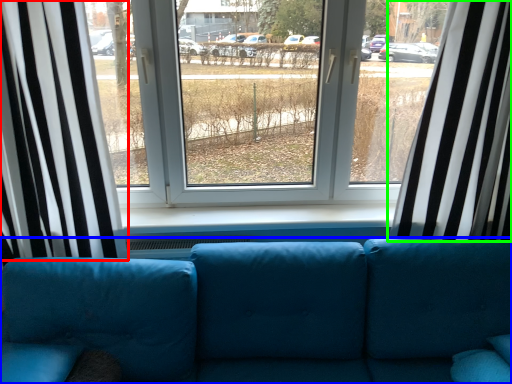
Question: Estimate the real-world distances between objects in this image. Which object is closer to curtain (highlighted by a red box), studio couch (highlighted by a blue box) or curtain (highlighted by a green box)?

Choices:
 (A) studio couch
 (B) curtain

Answer: (A)